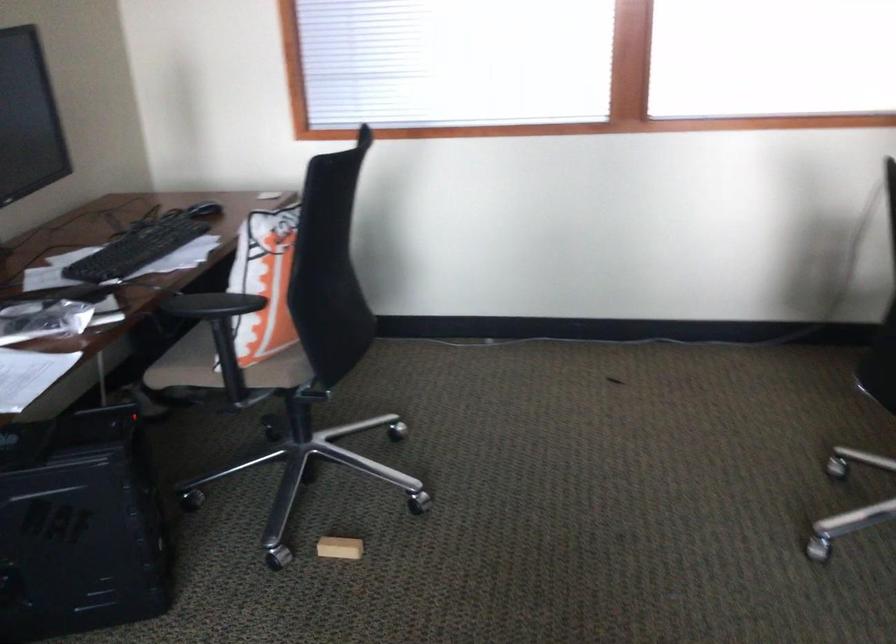
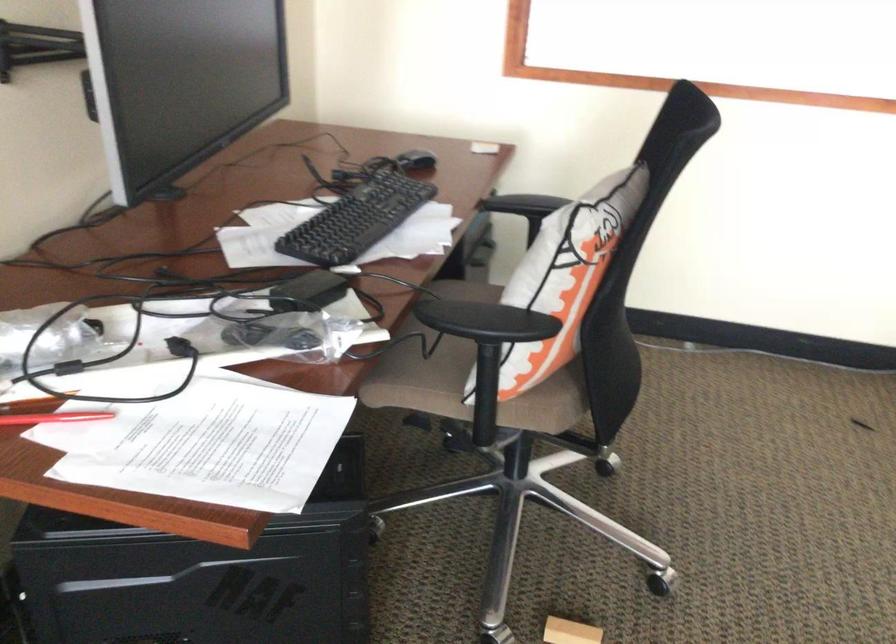
The point at (277, 368) is marked in the first image. Where is the corresponding point in the second image?

(543, 408)